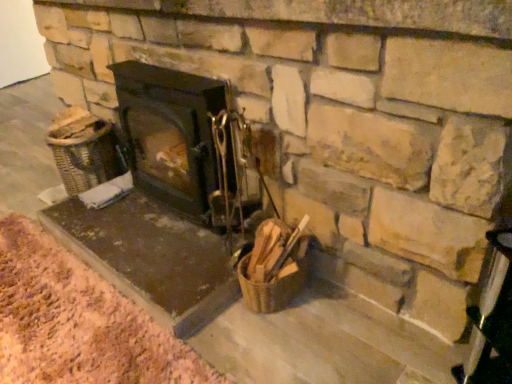
Question: Is matte black wood burning stove at center taller or shorter than brown textured mat at lower left?

Choices:
 (A) tall
 (B) short

Answer: (A)

Question: Is matte black wood burning stove at center wider or thinner than brown textured mat at lower left?

Choices:
 (A) thin
 (B) wide

Answer: (A)

Question: From a real-world perspective, is matte black wood burning stove at center physically located above or below brown textured mat at lower left?

Choices:
 (A) above
 (B) below

Answer: (A)

Question: From a real-world perspective, is brown textured mat at lower left above or below matte black wood burning stove at center?

Choices:
 (A) below
 (B) above

Answer: (A)

Question: In terms of width, does brown textured mat at lower left look wider or thinner when compared to matte black wood burning stove at center?

Choices:
 (A) wide
 (B) thin

Answer: (A)

Question: Is brown textured mat at lower left in front of or behind matte black wood burning stove at center in the image?

Choices:
 (A) behind
 (B) front

Answer: (B)

Question: Is brown textured mat at lower left situated inside matte black wood burning stove at center or outside?

Choices:
 (A) inside
 (B) outside

Answer: (B)